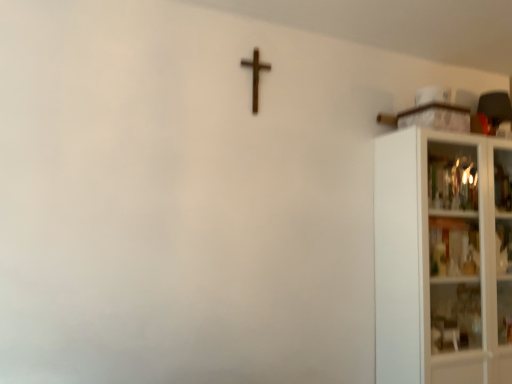
Question: In terms of height, does white glass cabinet at right look taller or shorter compared to wooden cross at upper center?

Choices:
 (A) short
 (B) tall

Answer: (B)

Question: Relative to wooden cross at upper center, is white glass cabinet at right in front or behind?

Choices:
 (A) behind
 (B) front

Answer: (B)

Question: In terms of width, does white glass cabinet at right look wider or thinner when compared to wooden cross at upper center?

Choices:
 (A) wide
 (B) thin

Answer: (A)

Question: Is wooden cross at upper center wider or thinner than white glass cabinet at right?

Choices:
 (A) thin
 (B) wide

Answer: (A)

Question: Is wooden cross at upper center to the left or to the right of white glass cabinet at right in the image?

Choices:
 (A) left
 (B) right

Answer: (A)

Question: Do you think wooden cross at upper center is within white glass cabinet at right, or outside of it?

Choices:
 (A) outside
 (B) inside

Answer: (A)

Question: From the image's perspective, relative to white glass cabinet at right, is wooden cross at upper center above or below?

Choices:
 (A) below
 (B) above

Answer: (B)